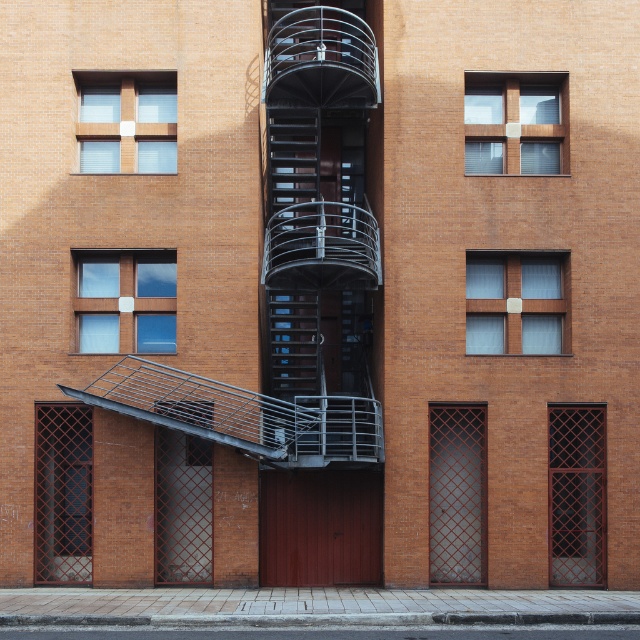
Question: Which object is farther from the camera taking this photo?

Choices:
 (A) matte glass window at center
 (B) clear glass window at lower left
 (C) matte black door at lower left

Answer: (A)

Question: Does matte wooden window at upper left appear over clear glass window at lower left?

Choices:
 (A) yes
 (B) no

Answer: (A)

Question: Which point is closer to the camera taking this photo?

Choices:
 (A) (500, 305)
 (B) (96, 314)
 (C) (56, 525)
 (D) (362, 266)

Answer: (D)

Question: Is metallic gray fire escape at center behind wooden frame at upper center?

Choices:
 (A) no
 (B) yes

Answer: (B)

Question: Is matte black door at lower left to the right of matte glass window at center from the viewer's perspective?

Choices:
 (A) yes
 (B) no

Answer: (B)

Question: Estimate the real-world distances between objects in this image. Which object is closer to the wooden frame at upper center?

Choices:
 (A) matte glass window at center
 (B) dark brown lattice door at right
 (C) matte wooden window at upper left

Answer: (A)